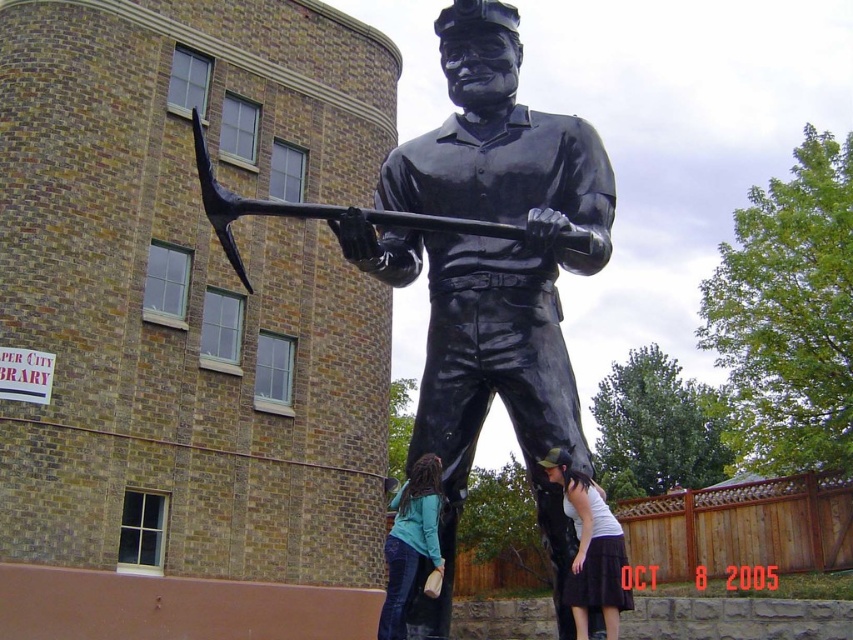
Who is more distant from viewer, (611, 538) or (584, 236)?

Positioned behind is point (611, 538).

Locate an element on the screen. The width and height of the screenshot is (853, 640). white fabric shirt at lower center is located at coordinates 590,547.

Find the location of `white fabric shirt at lower center`. white fabric shirt at lower center is located at coordinates (590, 547).

Can you confirm if white fabric shirt at lower center is taller than denim pants at lower center?

No, white fabric shirt at lower center is not taller than denim pants at lower center.

Who is shorter, white fabric shirt at lower center or denim pants at lower center?

Standing shorter between the two is white fabric shirt at lower center.

Who is more forward, [602,538] or [398,560]?

Point [398,560]

Locate an element on the screen. The image size is (853, 640). white fabric shirt at lower center is located at coordinates (590, 547).

Based on the photo, is black glossy statue at center wider than denim pants at lower center?

Correct, the width of black glossy statue at center exceeds that of denim pants at lower center.

Does point (436, 401) come closer to viewer compared to point (424, 568)?

No, it is not.

Locate an element on the screen. The image size is (853, 640). black glossy statue at center is located at coordinates (477, 269).